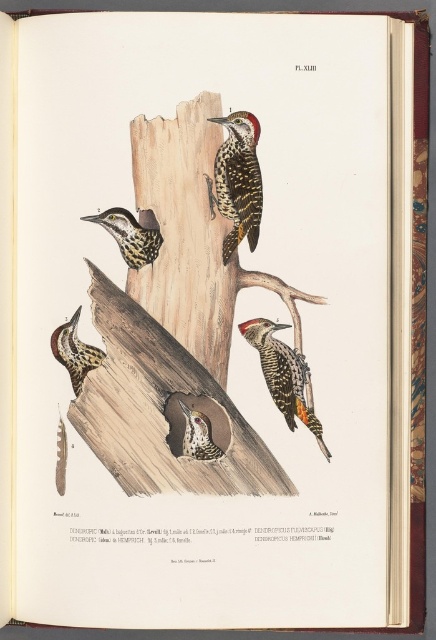
You are examining the botanical illustration labeled Pl. XLIII. You notice two points marked on the image at coordinates point (x=126, y=273) and point (x=265, y=349). From your perspective, which point is closer to you?

Point (x=126, y=273) is in front of point (x=265, y=349), so it is closer to you.